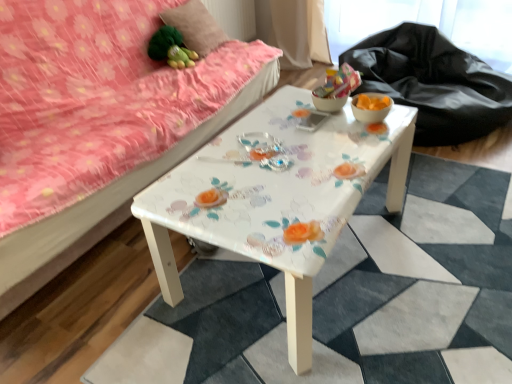
Question: Does point (388, 99) appear closer or farther from the camera than point (204, 33)?

Choices:
 (A) closer
 (B) farther

Answer: (A)

Question: Is matte orange glass bowl at right, which is the 1th glass bowl from right to left, bigger or smaller than fluffy pink pillow at upper left?

Choices:
 (A) big
 (B) small

Answer: (B)

Question: Which of these objects is positioned closest to the matte orange glass bowl at right, which is the 1th glass bowl from right to left?

Choices:
 (A) translucent glass bowl at center, the 2th glass bowl in the right-to-left sequence
 (B) white glossy table at center
 (C) black fabric at upper right
 (D) pink floral fabric studio couch at upper left
 (E) fluffy pink pillow at upper left

Answer: (A)

Question: Estimate the real-world distances between objects in this image. Which object is farther from the fluffy pink pillow at upper left?

Choices:
 (A) white glossy table at center
 (B) green fabric toy at upper left
 (C) matte orange glass bowl at right, the second glass bowl viewed from the left
 (D) black fabric at upper right
 (E) translucent glass bowl at center, acting as the first glass bowl starting from the left

Answer: (C)